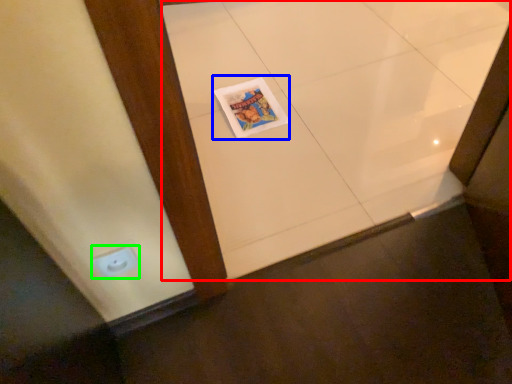
Question: Which object is the farthest from ceramic tile (highlighted by a red box)? Choose among these: magazine (highlighted by a blue box) or electric outlet (highlighted by a green box).

Choices:
 (A) magazine
 (B) electric outlet

Answer: (B)